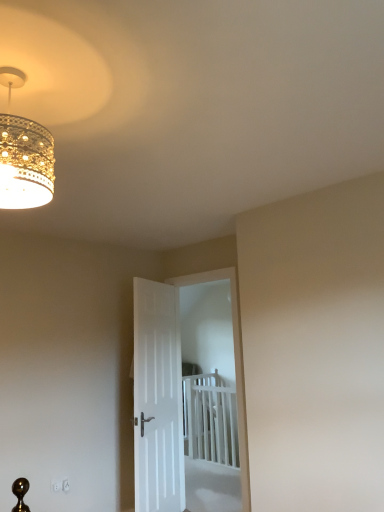
Question: From a real-world perspective, is white matte door at center, placed as the first door when sorted from right to left, located beneath white smooth door at center, marked as the 1th door in a left-to-right arrangement?

Choices:
 (A) yes
 (B) no

Answer: (B)

Question: Would you say white matte door at center, placed as the first door when sorted from right to left, is a long distance from white smooth door at center, marked as the 1th door in a left-to-right arrangement?

Choices:
 (A) yes
 (B) no

Answer: (A)

Question: Is white matte door at center, which appears as the 2th door when viewed from the left, further to camera compared to white smooth door at center, marked as the 1th door in a left-to-right arrangement?

Choices:
 (A) yes
 (B) no

Answer: (A)

Question: Is white matte door at center, which appears as the 2th door when viewed from the left, closer to camera compared to white smooth door at center, marked as the 1th door in a left-to-right arrangement?

Choices:
 (A) yes
 (B) no

Answer: (B)

Question: Does white matte door at center, which appears as the 2th door when viewed from the left, have a greater height compared to white smooth door at center, marked as the 1th door in a left-to-right arrangement?

Choices:
 (A) no
 (B) yes

Answer: (B)

Question: From a real-world perspective, is white matte door at center, which appears as the 2th door when viewed from the left, located higher than white smooth door at center, marked as the 1th door in a left-to-right arrangement?

Choices:
 (A) no
 (B) yes

Answer: (B)

Question: Considering the relative positions of white smooth door at center, marked as the second door in a right-to-left arrangement, and white plastic bed at center in the image provided, is white smooth door at center, marked as the second door in a right-to-left arrangement, to the right of white plastic bed at center from the viewer's perspective?

Choices:
 (A) yes
 (B) no

Answer: (B)

Question: Is white smooth door at center, marked as the 1th door in a left-to-right arrangement, facing away from white plastic bed at center?

Choices:
 (A) yes
 (B) no

Answer: (B)

Question: Is white smooth door at center, marked as the 1th door in a left-to-right arrangement, next to white plastic bed at center and touching it?

Choices:
 (A) yes
 (B) no

Answer: (B)

Question: From a real-world perspective, is white smooth door at center, marked as the second door in a right-to-left arrangement, physically below white plastic bed at center?

Choices:
 (A) yes
 (B) no

Answer: (B)

Question: Could white plastic bed at center be considered to be inside white smooth door at center, marked as the second door in a right-to-left arrangement?

Choices:
 (A) no
 (B) yes

Answer: (A)

Question: Is white smooth door at center, marked as the 1th door in a left-to-right arrangement, facing towards white plastic bed at center?

Choices:
 (A) no
 (B) yes

Answer: (A)

Question: From the image's perspective, is gold textured chandelier at upper left over white smooth door at center, marked as the 1th door in a left-to-right arrangement?

Choices:
 (A) yes
 (B) no

Answer: (A)